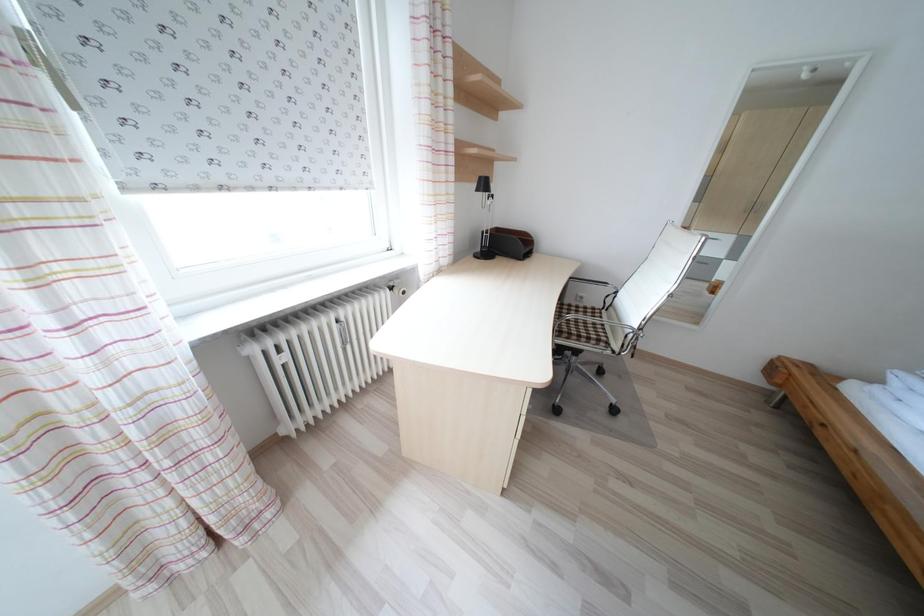
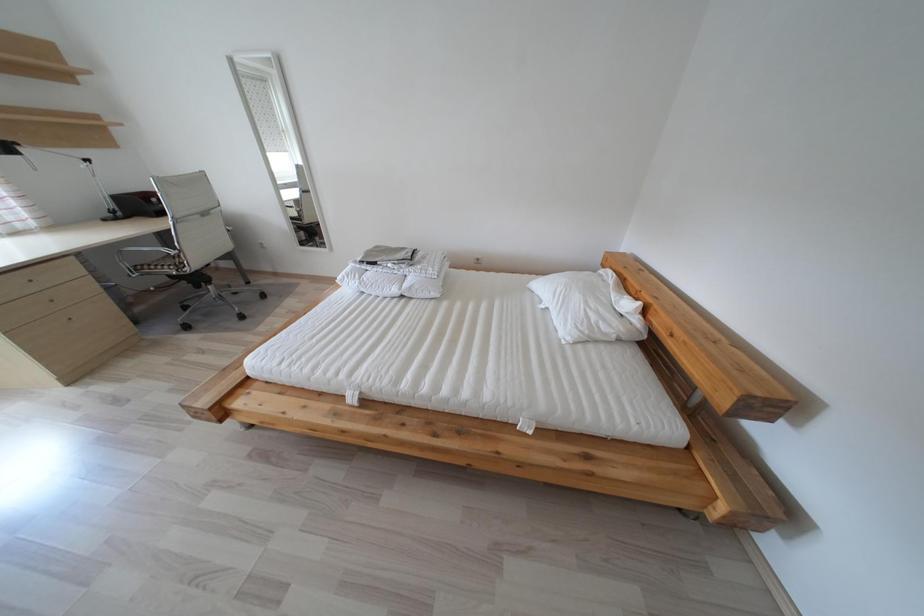
Which direction would the cameraman need to move to produce the second image?

The movement direction of the cameraman is right, backward.